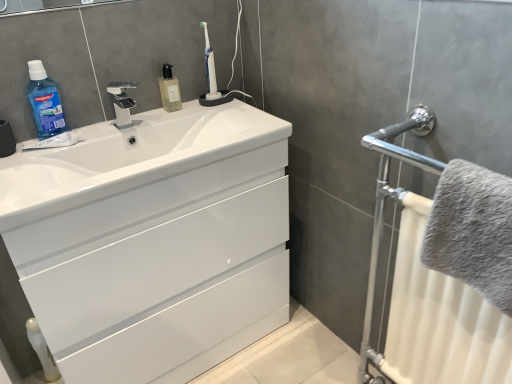
At what (x,y) coordinates should I click in order to perform the action: click on vacant area that lies to the right of blue translucent liquid at upper left. Please return your answer as a coordinate pair (x, y). Looking at the image, I should click on (101, 127).